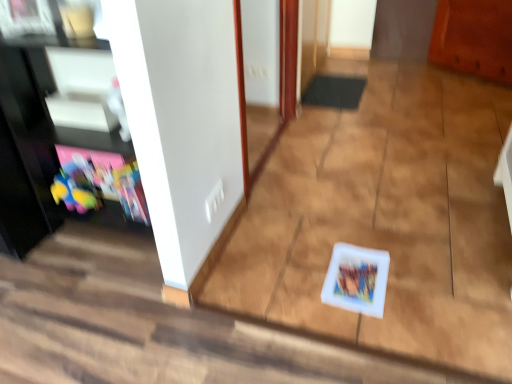
You are a GUI agent. You are given a task and a screenshot of the screen. Output one action in this format:
    pyautogui.click(x=<x>, y=<y>)
    Task: Click on the free space in front of white matte card game at center
    
    Given the screenshot: What is the action you would take?
    pyautogui.click(x=373, y=329)